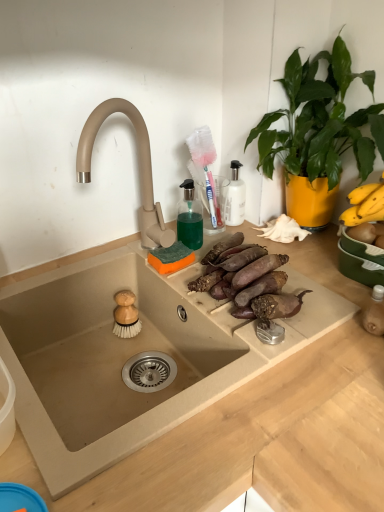
Where is `free space in front of brown rough sweet potatoes at center`? Image resolution: width=384 pixels, height=512 pixels. free space in front of brown rough sweet potatoes at center is located at coordinates (250, 354).